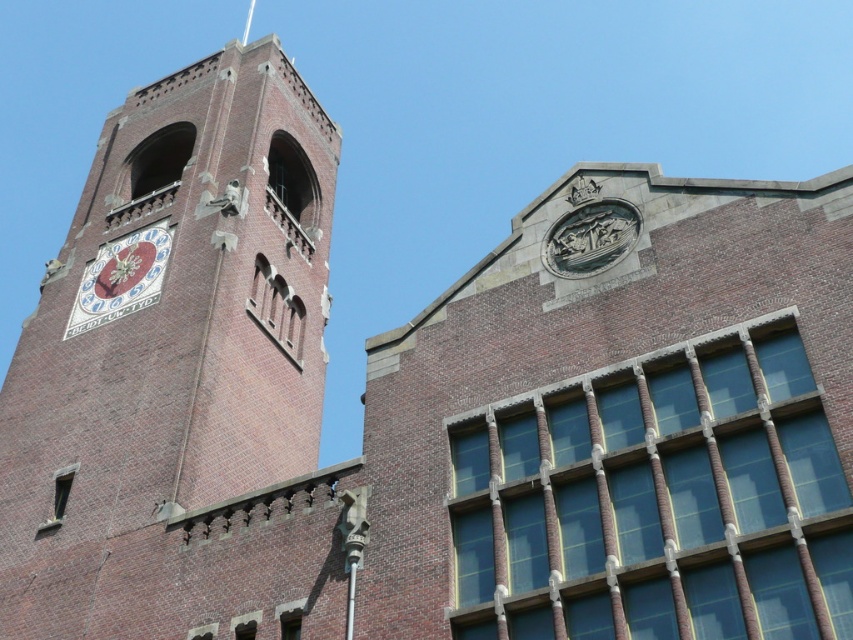
You are an architect designing a model of this building. You need to ensure the brick clock tower at left and the matte white clock at upper left are proportionate. Based on the scene, which object should be wider in your model?

The brick clock tower at left should be wider in the model since its width is larger than the matte white clock at upper left according to the description.

You are an architect examining the brick building. You notice the brick clock tower at left and the matte white clock at upper left. Which object is located higher up on the building?

The matte white clock at upper left is higher up because the brick clock tower at left is positioned under it.